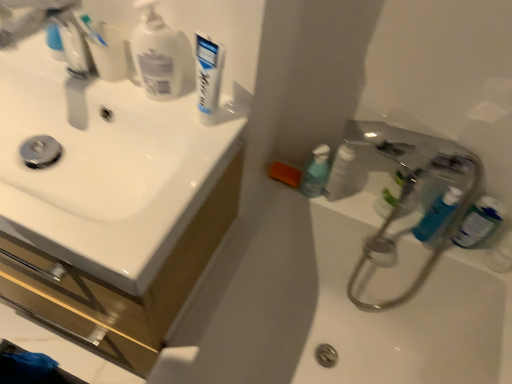
Find the location of a particular element. This screenshot has width=512, height=384. vacant space that is to the left of blue translucent bottle at right, the 2th toiletry in the right-to-left sequence is located at coordinates (371, 213).